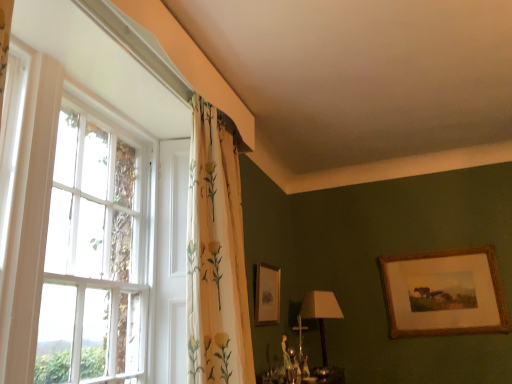
Question: Does white wooden window at left have a greater height compared to matte beige lampshade at lower center?

Choices:
 (A) no
 (B) yes

Answer: (B)

Question: Is white wooden window at left wider than matte beige lampshade at lower center?

Choices:
 (A) no
 (B) yes

Answer: (A)

Question: Can you confirm if white wooden window at left is thinner than matte beige lampshade at lower center?

Choices:
 (A) no
 (B) yes

Answer: (B)

Question: Does white wooden window at left appear on the right side of matte beige lampshade at lower center?

Choices:
 (A) no
 (B) yes

Answer: (A)

Question: From the image's perspective, would you say white wooden window at left is positioned over matte beige lampshade at lower center?

Choices:
 (A) no
 (B) yes

Answer: (B)

Question: From a real-world perspective, is matte beige lampshade at lower center above or below white wooden window at left?

Choices:
 (A) above
 (B) below

Answer: (B)

Question: Considering the positions of point (317, 294) and point (139, 135), is point (317, 294) closer or farther from the camera than point (139, 135)?

Choices:
 (A) farther
 (B) closer

Answer: (A)

Question: Is matte beige lampshade at lower center inside or outside of white wooden window at left?

Choices:
 (A) inside
 (B) outside

Answer: (B)

Question: In terms of size, does matte beige lampshade at lower center appear bigger or smaller than white wooden window at left?

Choices:
 (A) big
 (B) small

Answer: (B)

Question: Is matte beige lampshade at lower center bigger or smaller than gold-framed picture at upper right, which is the first picture frame from right to left?

Choices:
 (A) small
 (B) big

Answer: (A)

Question: From the image's perspective, is matte beige lampshade at lower center located above or below gold-framed picture at upper right, which is counted as the second picture frame, starting from the left?

Choices:
 (A) below
 (B) above

Answer: (A)

Question: In terms of height, does matte beige lampshade at lower center look taller or shorter compared to gold-framed picture at upper right, which is the first picture frame from right to left?

Choices:
 (A) short
 (B) tall

Answer: (A)

Question: In terms of width, does matte beige lampshade at lower center look wider or thinner when compared to gold-framed picture at upper right, which is the first picture frame from right to left?

Choices:
 (A) wide
 (B) thin

Answer: (A)

Question: Is point (219, 236) closer or farther from the camera than point (269, 307)?

Choices:
 (A) farther
 (B) closer

Answer: (B)

Question: Is white floral fabric curtain at upper left in front of or behind gold-framed picture at upper right, the second picture frame positioned from the right, in the image?

Choices:
 (A) front
 (B) behind

Answer: (A)